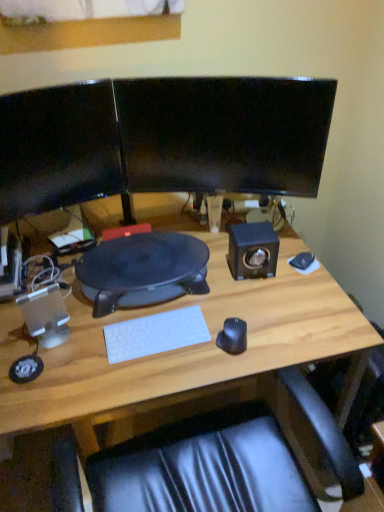
The height and width of the screenshot is (512, 384). Identify the location of free space between matte black speaker at right, the second speaker in the bottom-to-top sequence, and black rubberized desk at center. (225, 268).